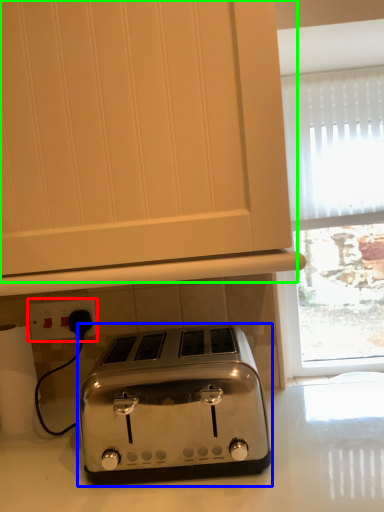
Question: Which is farther away from electric outlet (highlighted by a red box)? toaster (highlighted by a blue box) or oven (highlighted by a green box)?

Choices:
 (A) toaster
 (B) oven

Answer: (B)